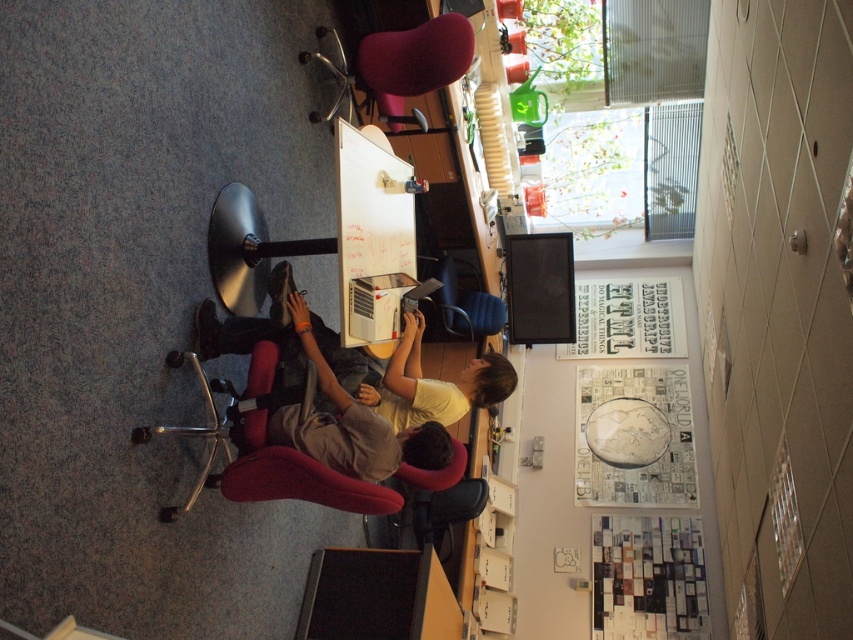
Is velvet red swivel chair at upper center below blue fabric chair at center?

No, velvet red swivel chair at upper center is not below blue fabric chair at center.

Which is above, velvet red swivel chair at upper center or blue fabric chair at center?

Positioned higher is velvet red swivel chair at upper center.

At what (x,y) coordinates should I click in order to perform the action: click on velvet red swivel chair at upper center. Please return your answer as a coordinate pair (x, y). Looking at the image, I should click on pyautogui.click(x=403, y=65).